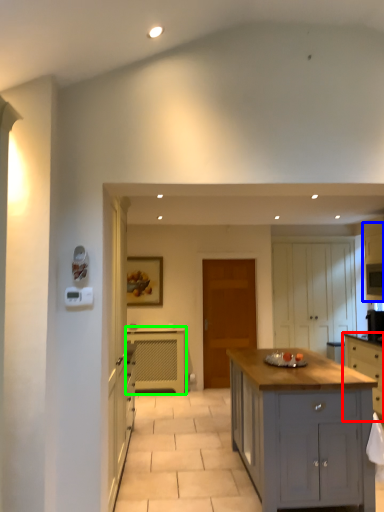
Question: Which object is positioned farthest from cabinetry (highlighted by a red box)? Select from cabinetry (highlighted by a blue box) and cabinetry (highlighted by a green box).

Choices:
 (A) cabinetry
 (B) cabinetry

Answer: (B)